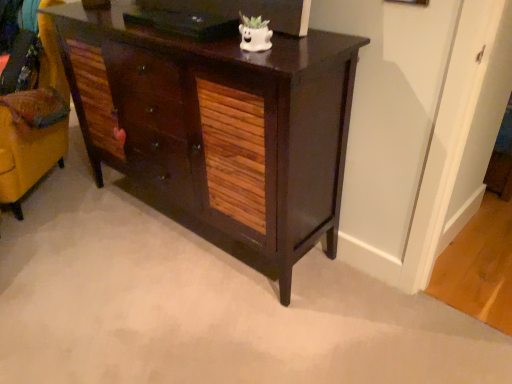
Question: From a real-world perspective, is dark wood cabinet at center physically above velvet yellow swivel chair at left?

Choices:
 (A) no
 (B) yes

Answer: (B)

Question: From the image's perspective, does dark wood cabinet at center appear higher than velvet yellow swivel chair at left?

Choices:
 (A) no
 (B) yes

Answer: (A)

Question: Is dark wood cabinet at center smaller than velvet yellow swivel chair at left?

Choices:
 (A) yes
 (B) no

Answer: (B)

Question: Is dark wood cabinet at center thinner than velvet yellow swivel chair at left?

Choices:
 (A) no
 (B) yes

Answer: (B)

Question: Is dark wood cabinet at center to the right of velvet yellow swivel chair at left from the viewer's perspective?

Choices:
 (A) no
 (B) yes

Answer: (B)

Question: Is dark wood cabinet at center at the left side of velvet yellow swivel chair at left?

Choices:
 (A) no
 (B) yes

Answer: (A)

Question: From a real-world perspective, is velvet yellow swivel chair at left below dark wood cabinet at center?

Choices:
 (A) yes
 (B) no

Answer: (A)

Question: Is velvet yellow swivel chair at left bigger than dark wood cabinet at center?

Choices:
 (A) yes
 (B) no

Answer: (B)

Question: Considering the relative sizes of velvet yellow swivel chair at left and dark wood cabinet at center in the image provided, is velvet yellow swivel chair at left thinner than dark wood cabinet at center?

Choices:
 (A) no
 (B) yes

Answer: (A)

Question: Does velvet yellow swivel chair at left have a smaller size compared to dark wood cabinet at center?

Choices:
 (A) yes
 (B) no

Answer: (A)

Question: Does velvet yellow swivel chair at left have a lesser height compared to dark wood cabinet at center?

Choices:
 (A) yes
 (B) no

Answer: (B)

Question: Is velvet yellow swivel chair at left behind dark wood cabinet at center?

Choices:
 (A) yes
 (B) no

Answer: (A)

Question: Do you think dark wood cabinet at center is within velvet yellow swivel chair at left, or outside of it?

Choices:
 (A) outside
 (B) inside

Answer: (A)